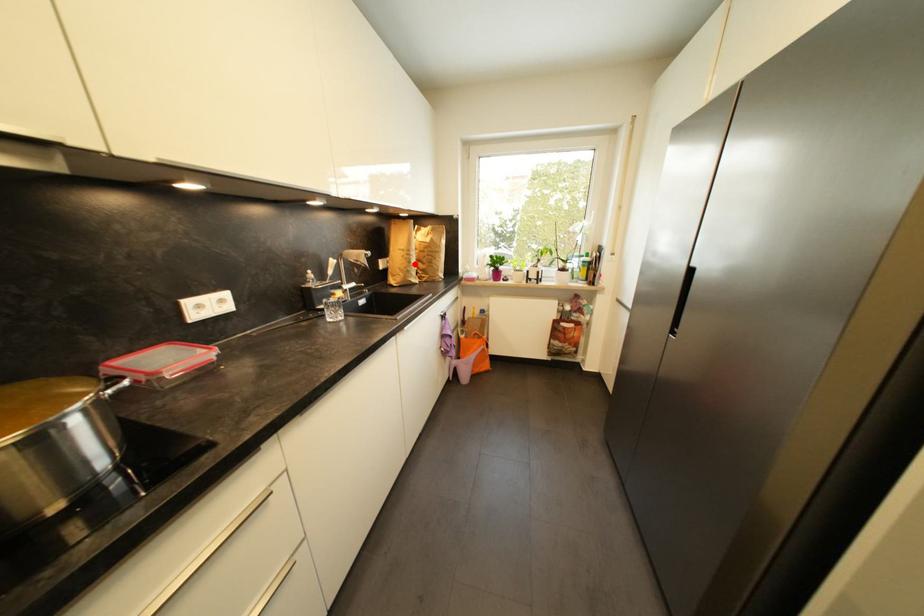
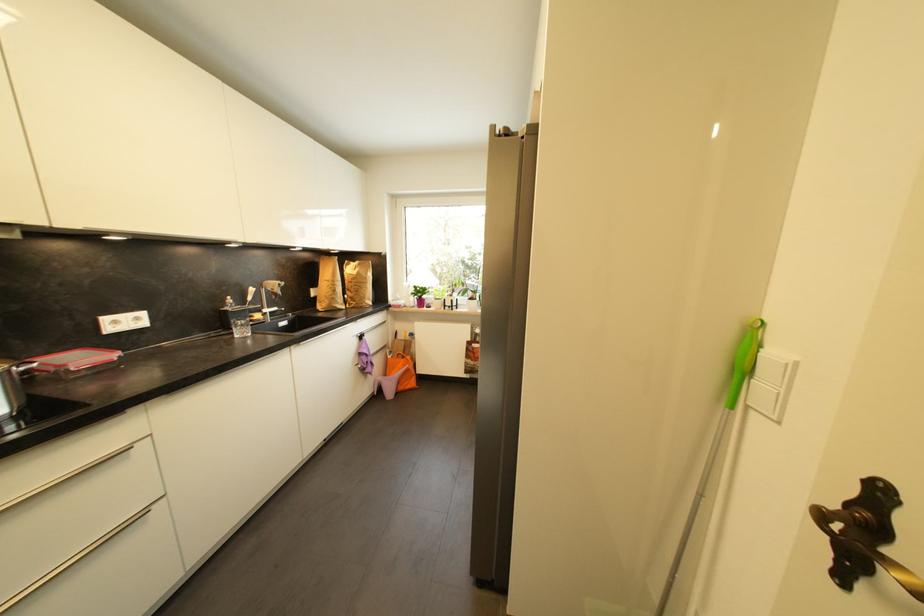
The point at the highlighted location is marked in the first image. Where is the corresponding point in the second image?

(339, 293)